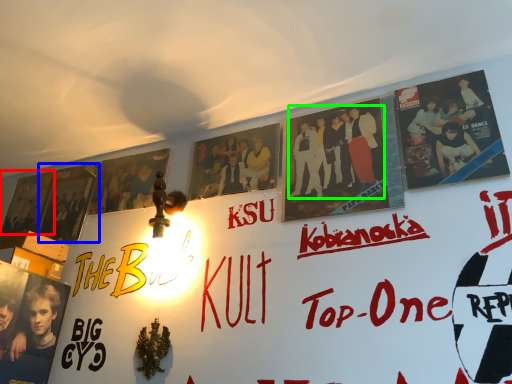
Question: Based on their relative distances, which object is nearer to movie poster (highlighted by a red box)? Choose from poster (highlighted by a blue box) and person (highlighted by a green box).

Choices:
 (A) poster
 (B) person

Answer: (A)